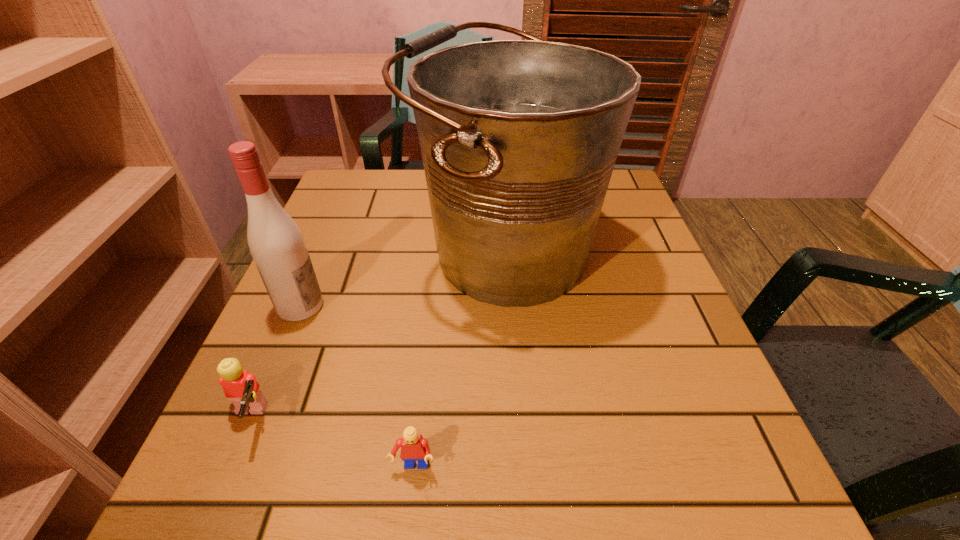
Identify the location of free space at the near left corner. The width and height of the screenshot is (960, 540). (206, 464).

Where is `free space at the far right corner of the desktop`? This screenshot has height=540, width=960. free space at the far right corner of the desktop is located at coordinates (612, 200).

I want to click on free region at the near right corner of the desktop, so click(x=690, y=475).

Image resolution: width=960 pixels, height=540 pixels. What are the coordinates of `vacant area that lies between the bucket and the second shortest object` in the screenshot? It's located at pos(376,336).

Image resolution: width=960 pixels, height=540 pixels. What are the coordinates of `free area in between the farther Lego and the shortest object` in the screenshot? It's located at (331, 443).

This screenshot has width=960, height=540. Find the location of `vacant region between the nearer Lego and the bucket`. vacant region between the nearer Lego and the bucket is located at coordinates (459, 360).

Locate an element on the screen. Image resolution: width=960 pixels, height=540 pixels. free space between the shortest object and the taller Lego is located at coordinates (331, 443).

Identify the location of unoccupied position between the nearer Lego and the third farthest object. The image size is (960, 540). (331, 443).

Find the location of a particular element. vacant area between the bucket and the alcohol is located at coordinates (402, 279).

Image resolution: width=960 pixels, height=540 pixels. In order to click on blank region between the shortest object and the third shortest object in this screenshot , I will do (x=357, y=387).